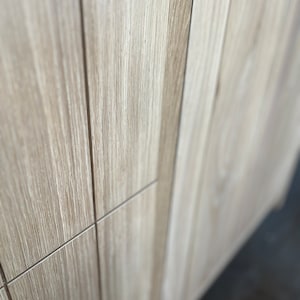
Locate an element on the screen. The height and width of the screenshot is (300, 300). the bottom edge of the furniture piece is located at coordinates (239, 243).